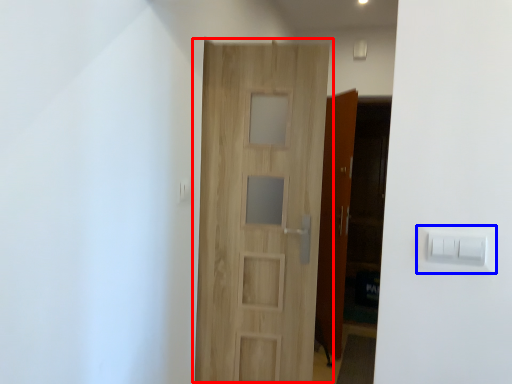
Question: Which point is further to the camera, door (highlighted by a red box) or light switch (highlighted by a blue box)?

Choices:
 (A) door
 (B) light switch

Answer: (A)